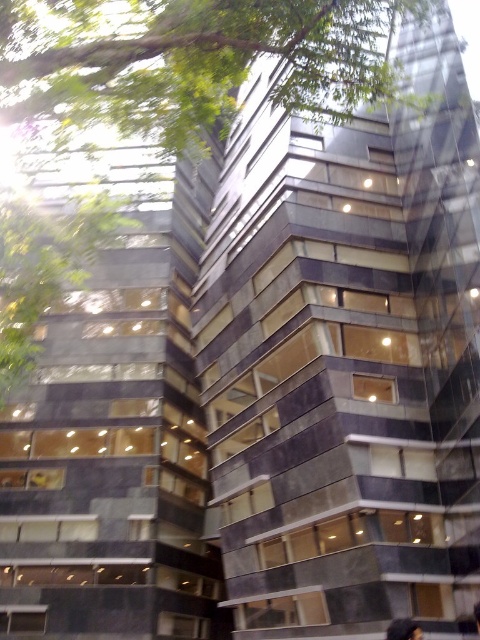
Who is lower down, green leafy tree at upper left or dark hair at upper center?

Positioned lower is dark hair at upper center.

Is green leafy tree at upper left closer to the viewer compared to dark hair at upper center?

Yes, it is.

Measure the distance between green leafy tree at upper left and camera.

They are 8.43 meters apart.

Identify the location of green leafy tree at upper left. The width and height of the screenshot is (480, 640). (189, 61).